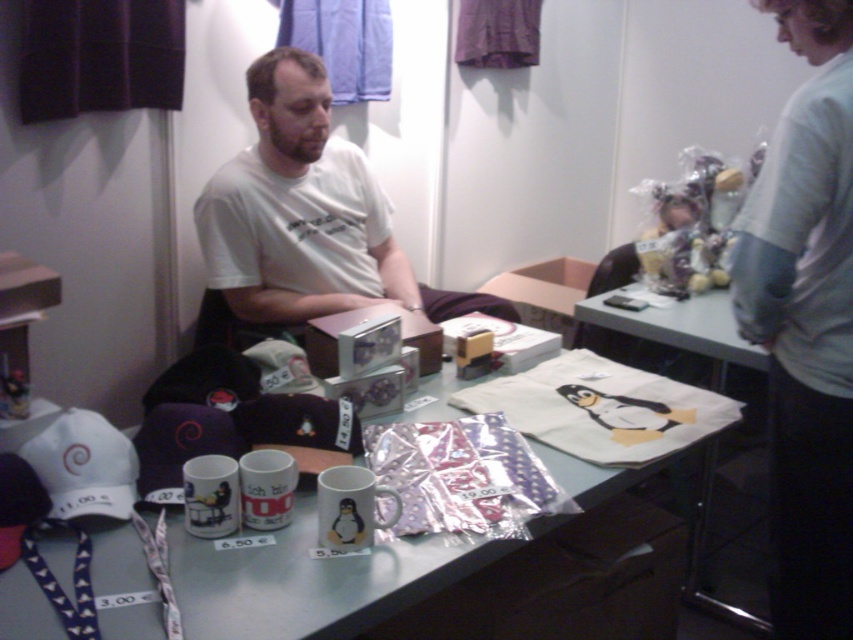
Question: Which object appears farthest from the camera in this image?

Choices:
 (A) white t-shirt at center
 (B) white fabric baseball cap at lower left
 (C) white paper bag at center
 (D) purple fabric baseball cap at lower left

Answer: (A)

Question: Is white fabric baseball cap at lower left wider than purple fabric baseball cap at lower left?

Choices:
 (A) no
 (B) yes

Answer: (B)

Question: Which of the following is the closest to the observer?

Choices:
 (A) gray sweater at right
 (B) metallic silver table at center

Answer: (B)

Question: Which object is farther from the camera taking this photo?

Choices:
 (A) metallic silver table at center
 (B) white t-shirt at center

Answer: (B)

Question: Can you confirm if gray sweater at right is positioned below white fabric baseball cap at lower left?

Choices:
 (A) no
 (B) yes

Answer: (A)

Question: Is gray sweater at right to the right of metallic silver table at center from the viewer's perspective?

Choices:
 (A) yes
 (B) no

Answer: (A)